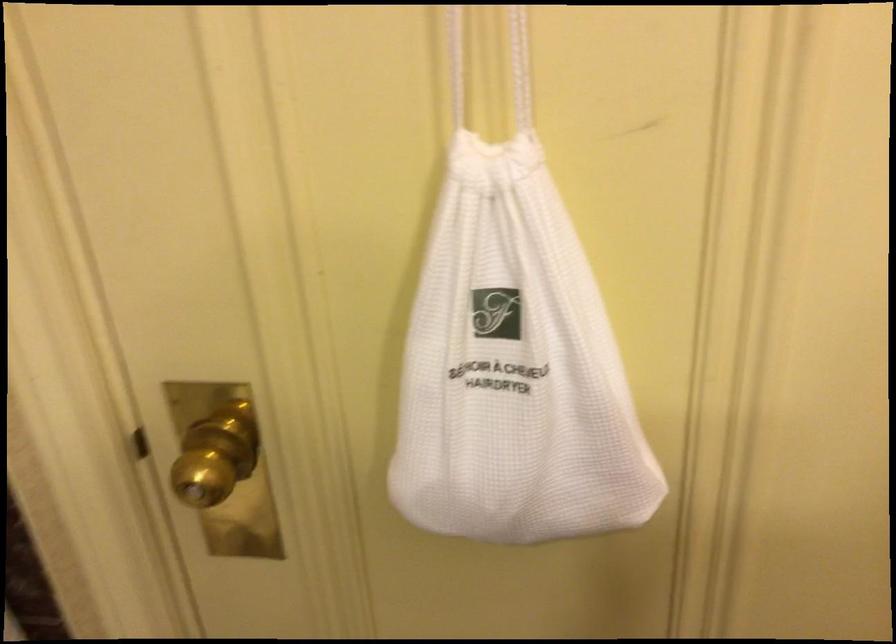
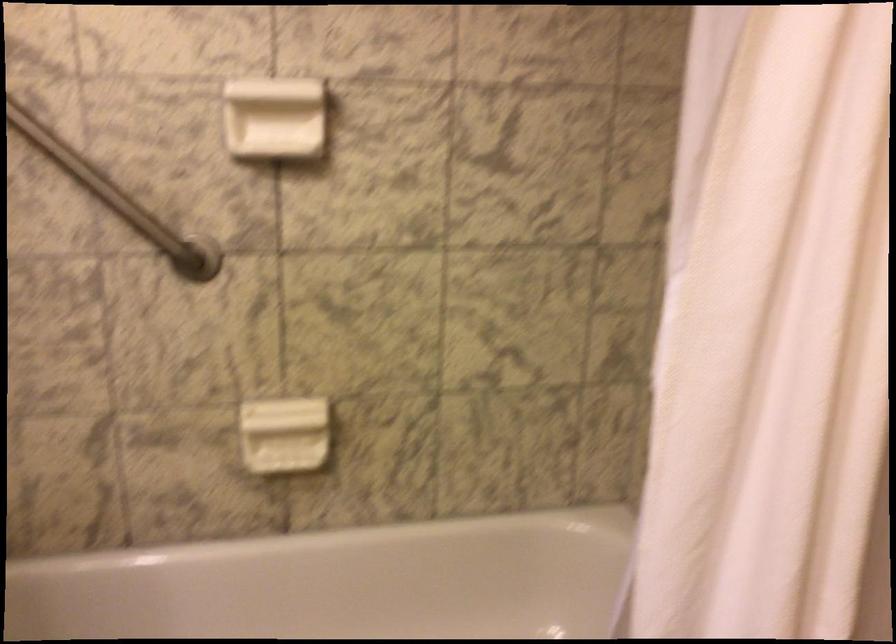
Question: The images are taken continuously from a first-person perspective. In which direction is your viewpoint rotating?

Choices:
 (A) Left
 (B) Right
 (C) Up
 (D) Down

Answer: (A)